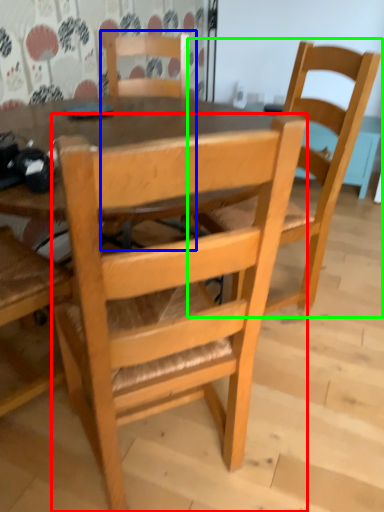
Question: Which is farther away from chair (highlighted by a red box)? chair (highlighted by a blue box) or chair (highlighted by a green box)?

Choices:
 (A) chair
 (B) chair

Answer: (A)